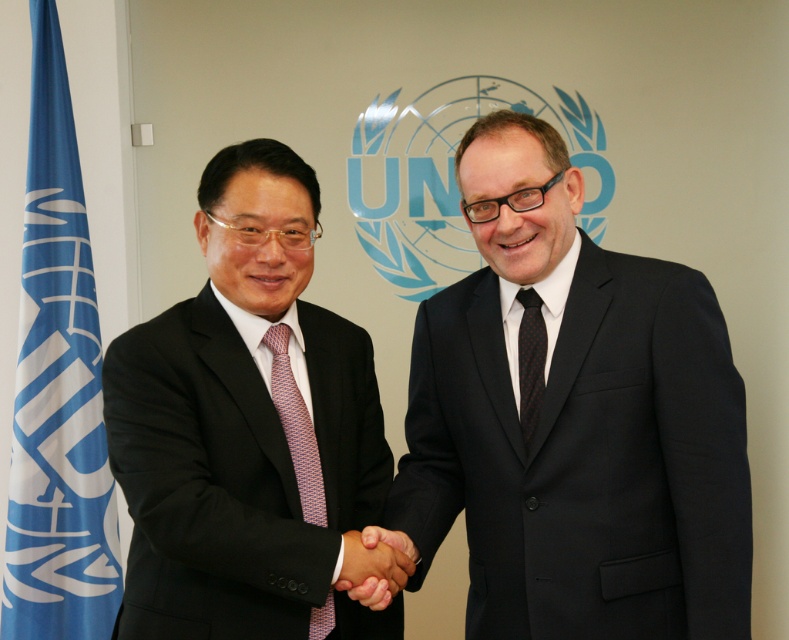
Question: Is black matte suit at center closer to camera compared to blue fabric flag at left?

Choices:
 (A) no
 (B) yes

Answer: (B)

Question: Is smooth skin handshake at center closer to camera compared to black dotted tie at center?

Choices:
 (A) yes
 (B) no

Answer: (A)

Question: Can you confirm if pink dotted tie at center is smaller than black dotted tie at center?

Choices:
 (A) no
 (B) yes

Answer: (A)

Question: Which of the following is the closest to the observer?

Choices:
 (A) smooth skin handshake at center
 (B) pink dotted tie at center
 (C) black matte suit at center

Answer: (A)

Question: Which of these objects is positioned farthest from the smooth skin handshake at center?

Choices:
 (A) pink dotted tie at center
 (B) matte black suit at left
 (C) blue fabric flag at left

Answer: (C)

Question: Which of the following is the farthest from the observer?

Choices:
 (A) (275, 378)
 (B) (528, 340)
 (C) (62, 204)
 (D) (365, 554)

Answer: (C)